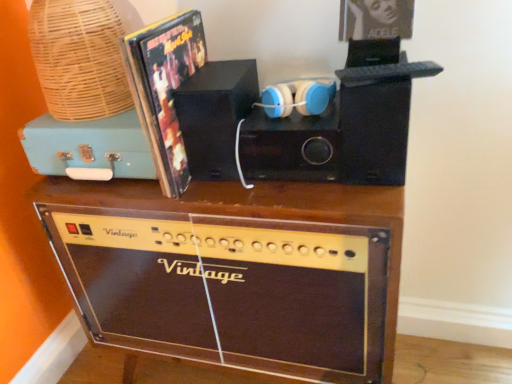
This screenshot has width=512, height=384. I want to click on vacant region in front of black matte speaker at center, the first speaker when ordered from right to left, so click(x=310, y=192).